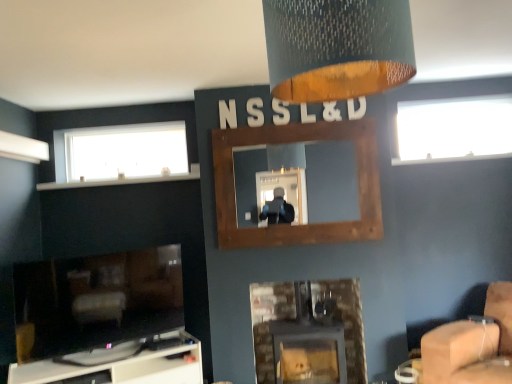
Where is `vacant space situated above rustic wood fireplace at center, marked as the 2th fireplace in a left-to-right arrangement (from a real-world perspective)`? vacant space situated above rustic wood fireplace at center, marked as the 2th fireplace in a left-to-right arrangement (from a real-world perspective) is located at coordinates (293, 125).